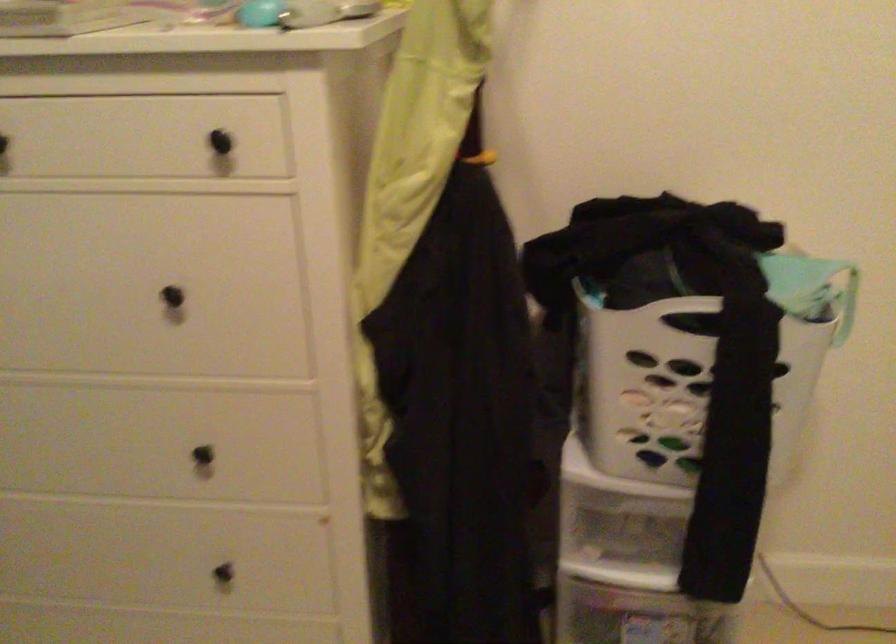
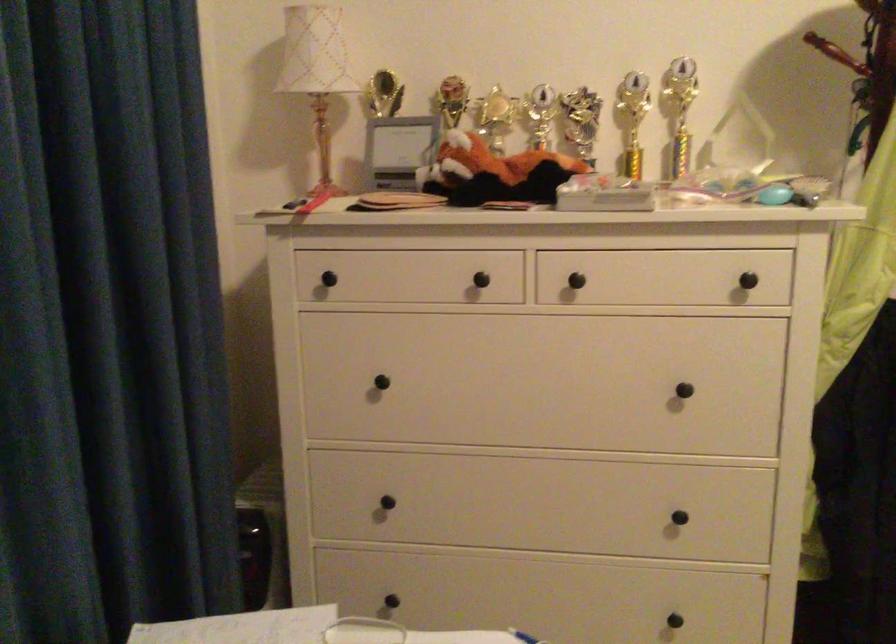
Which direction would the cameraman need to move to produce the second image?

The cameraman walked toward left, backward.